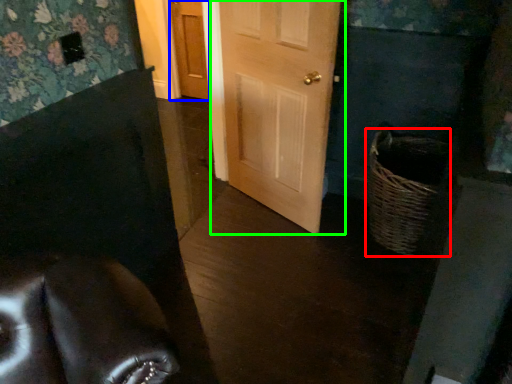
Question: Which is farther away from basket (highlighted by a red box)? door (highlighted by a blue box) or door (highlighted by a green box)?

Choices:
 (A) door
 (B) door

Answer: (A)